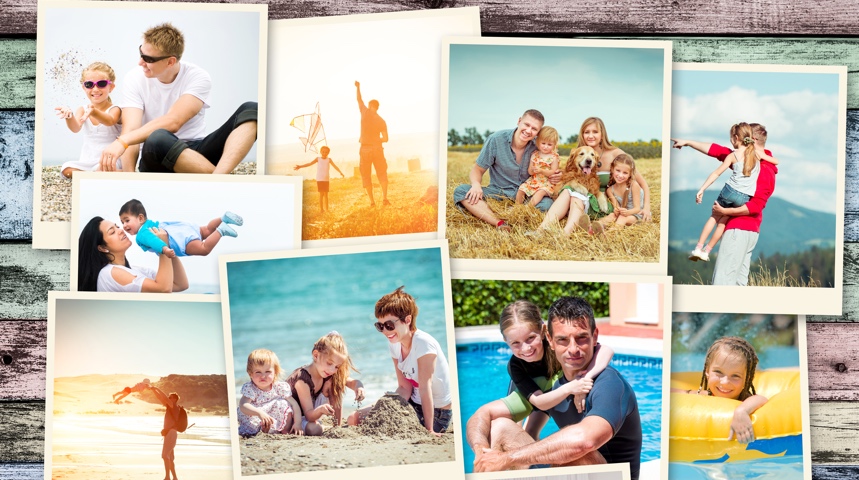
The image size is (859, 480). What are the coordinates of `wooden slots` in the screenshot? It's located at (835, 423), (838, 469), (837, 366), (848, 289), (853, 201), (853, 72), (754, 12).